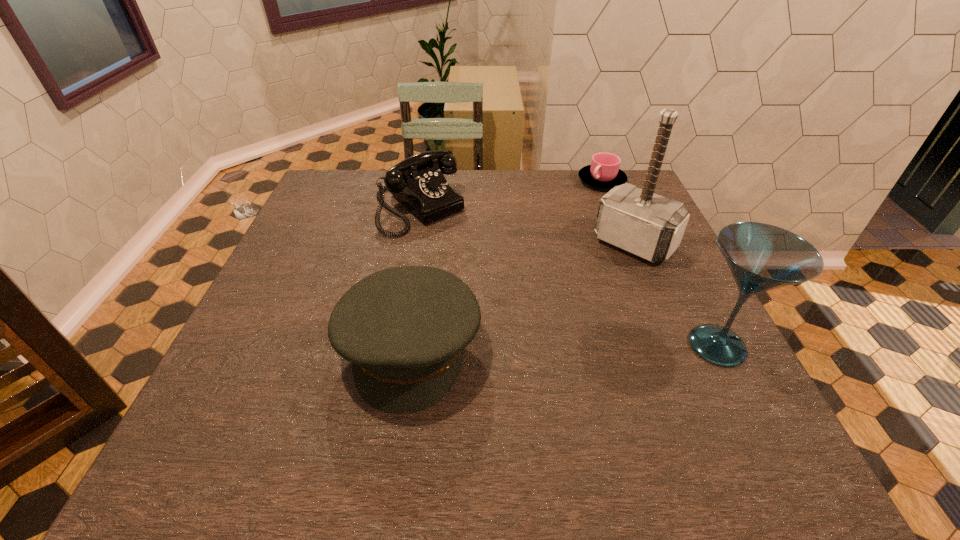
Locate an element on the screen. The image size is (960, 540). vacant space at the far right corner of the desktop is located at coordinates (593, 191).

Identify the location of unoccupied area between the fourth shortest object and the cup. This screenshot has height=540, width=960. (660, 264).

At what (x,y) coordinates should I click in order to perform the action: click on unoccupied area between the shortest object and the beret. Please return your answer as a coordinate pair (x, y). Looking at the image, I should click on (506, 265).

Where is `empty space that is in between the shortest object and the beret`? The image size is (960, 540). empty space that is in between the shortest object and the beret is located at coordinates (506, 265).

This screenshot has height=540, width=960. Identify the location of vacant area that lies between the beret and the martini. (564, 347).

The image size is (960, 540). I want to click on unoccupied area between the hammer and the martini, so click(x=676, y=294).

You are a GUI agent. You are given a task and a screenshot of the screen. Output one action in this format:
    pyautogui.click(x=<x>, y=<y>)
    Task: Click on the free point between the cup and the beret
    This screenshot has width=960, height=540.
    Given the screenshot: What is the action you would take?
    pyautogui.click(x=506, y=265)

Find the location of a particular element. The image size is (960, 540). object that can be found as the second closest to the cup is located at coordinates (418, 182).

Identify which object is located as the fourth nearest to the tallest object. Please provide its 2D coordinates. Your answer should be formatted as a tuple, i.e. [(x, y)], where the tuple contains the x and y coordinates of a point satisfying the conditions above.

[(418, 182)]

Find the location of a particular element. free spot that satisfies the following two spatial constraints: 1. on the front side of the second tallest object; 2. on the right side of the hammer is located at coordinates (678, 346).